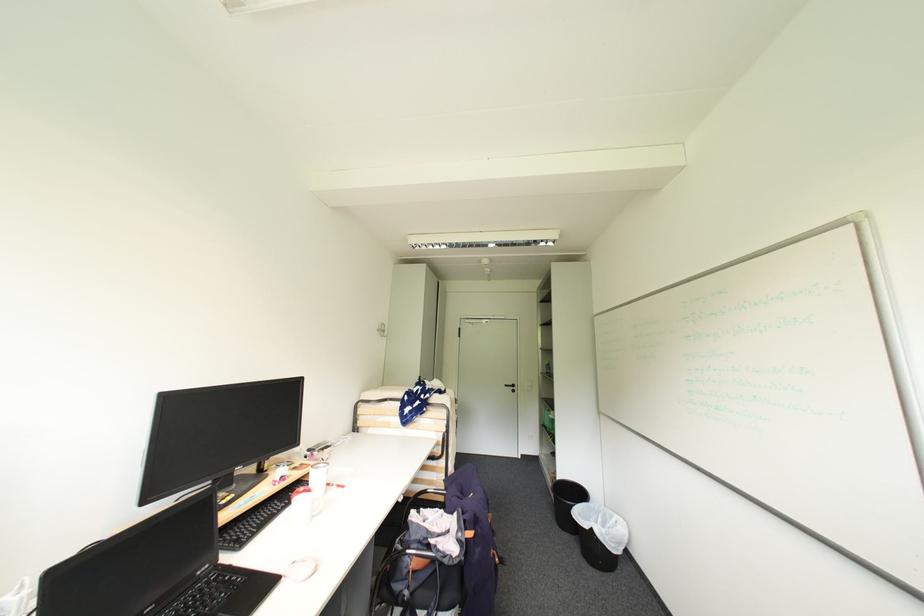
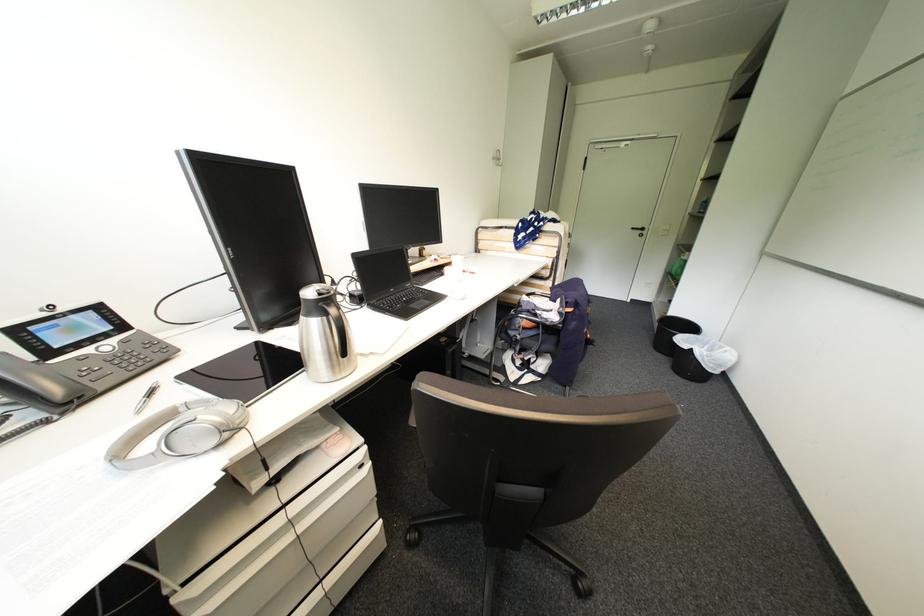
Where in the second image is the point corresponding to the point at 584,538 from the first image?

(677, 359)